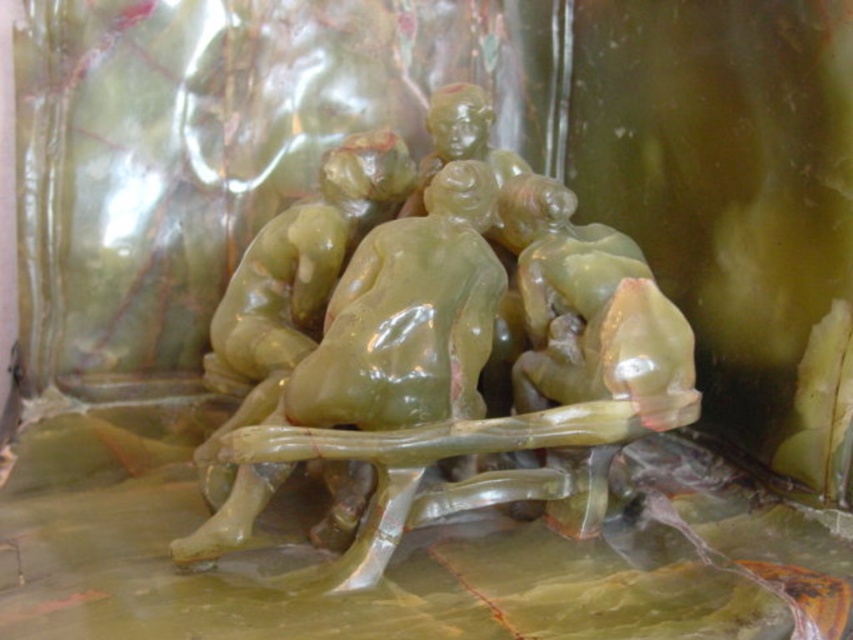
Question: Which point is closer to the camera?

Choices:
 (A) green translucent statue at center
 (B) green polished stone statue at center

Answer: (A)

Question: Is green translucent statue at center smaller than green polished stone statue at center?

Choices:
 (A) no
 (B) yes

Answer: (A)

Question: Does green translucent statue at center appear on the left side of green polished stone statue at center?

Choices:
 (A) yes
 (B) no

Answer: (B)

Question: Which of the following is the farthest from the observer?

Choices:
 (A) green polished stone statue at center
 (B) green translucent statue at center

Answer: (A)

Question: Which point is farther to the camera?

Choices:
 (A) (196, 536)
 (B) (242, 264)

Answer: (B)

Question: Is green translucent statue at center positioned behind green polished stone statue at center?

Choices:
 (A) yes
 (B) no

Answer: (B)